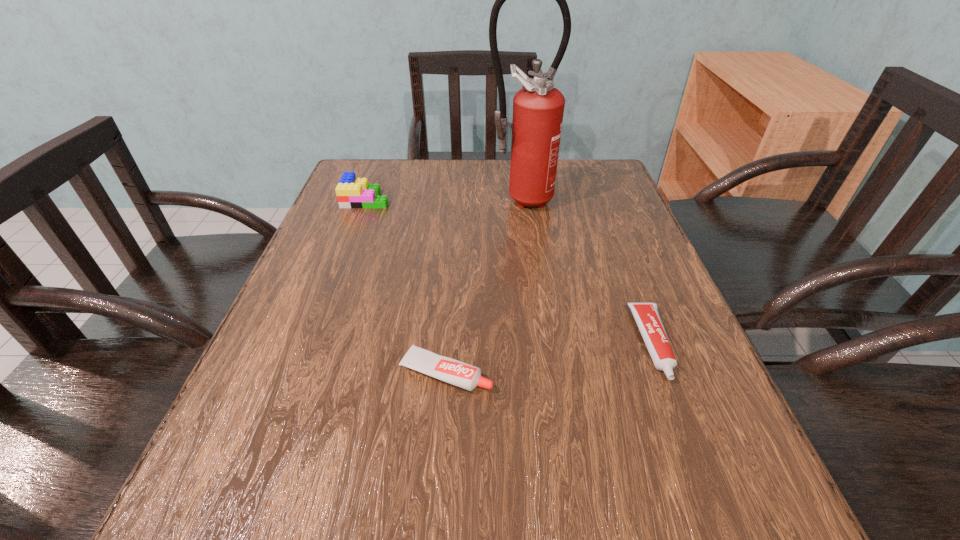
Where is `empty location between the right toothpaste and the left toothpaste`? The image size is (960, 540). empty location between the right toothpaste and the left toothpaste is located at coordinates (549, 358).

Where is `the closest object relative to the left toothpaste`? This screenshot has height=540, width=960. the closest object relative to the left toothpaste is located at coordinates (646, 315).

Image resolution: width=960 pixels, height=540 pixels. Identify the location of object that is the nearest to the tallest object. (352, 192).